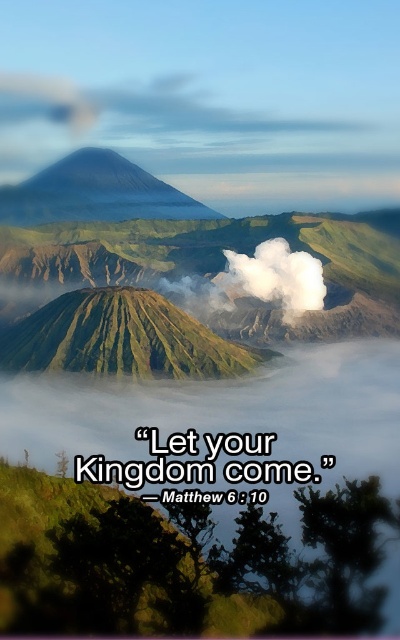
Question: Among these points, which one is farthest from the camera?

Choices:
 (A) (168, 100)
 (B) (177, 365)

Answer: (A)

Question: Observing the image, what is the correct spatial positioning of green grassy mountain at center in reference to gray volcanic peak at upper left?

Choices:
 (A) below
 (B) above

Answer: (A)

Question: Which object appears farthest from the camera in this image?

Choices:
 (A) green grassy mountain at center
 (B) white fluffy cloud at upper left

Answer: (B)

Question: Where is white fluffy cloud at upper left located in relation to gray volcanic peak at upper left in the image?

Choices:
 (A) right
 (B) left

Answer: (A)

Question: Which point appears farthest from the camera in this image?

Choices:
 (A) (53, 192)
 (B) (229, 129)
 (C) (204, 374)

Answer: (B)

Question: Can you confirm if green grassy mountain at center is positioned below gray volcanic peak at upper left?

Choices:
 (A) no
 (B) yes

Answer: (B)